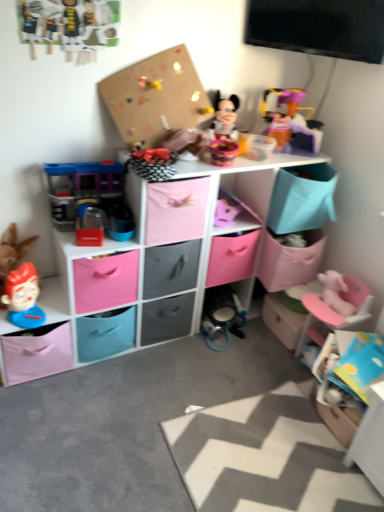
Question: Considering the positions of smooth plastic toy head at lower left, the first toy positioned from the left, and pink plastic swivel chair at lower right in the image, is smooth plastic toy head at lower left, the first toy positioned from the left, wider or thinner than pink plastic swivel chair at lower right?

Choices:
 (A) wide
 (B) thin

Answer: (B)

Question: In terms of height, does smooth plastic toy head at lower left, the first toy positioned from the left, look taller or shorter compared to pink plastic swivel chair at lower right?

Choices:
 (A) short
 (B) tall

Answer: (A)

Question: Estimate the real-world distances between objects in this image. Which object is farther from the plastic playhouse at left, which is the 2th toy in left-to-right order?

Choices:
 (A) smooth plastic toy head at lower left, acting as the 3th toy starting from the right
 (B) blue cardboard box at lower right, which ranks as the first storage box in right-to-left order
 (C) pink plastic swivel chair at lower right
 (D) translucent plastic toy at upper right, which is the 1th toy in right-to-left order
 (E) pink fabric storage cubes at center

Answer: (B)

Question: Based on their relative distances, which object is farther from the blue cardboard box at lower right, which appears as the third storage box when viewed from the left?

Choices:
 (A) smooth plastic toy head at lower left, acting as the 3th toy starting from the right
 (B) pink fabric storage box at left, arranged as the 1th storage box when viewed from the left
 (C) plastic playhouse at left, the 2th toy in the top-to-bottom sequence
 (D) pink plastic swivel chair at lower right
 (E) wooden toy at lower right, which is the 2th storage box in right-to-left order

Answer: (A)